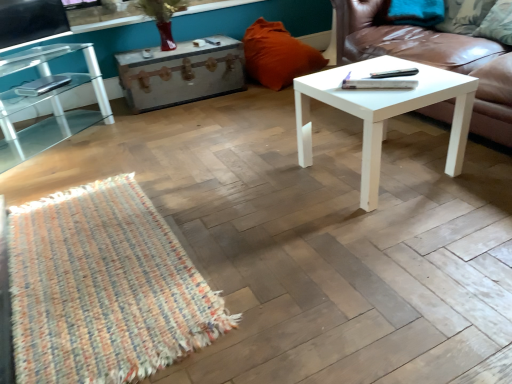
Question: Could you tell me if white leather couch at right is turned towards rustic wood trunk at center?

Choices:
 (A) yes
 (B) no

Answer: (B)

Question: Considering the relative sizes of white leather couch at right and rustic wood trunk at center in the image provided, is white leather couch at right taller than rustic wood trunk at center?

Choices:
 (A) no
 (B) yes

Answer: (B)

Question: Does white leather couch at right have a greater width compared to rustic wood trunk at center?

Choices:
 (A) yes
 (B) no

Answer: (A)

Question: Can you confirm if white leather couch at right is positioned to the left of rustic wood trunk at center?

Choices:
 (A) no
 (B) yes

Answer: (A)

Question: Are white leather couch at right and rustic wood trunk at center beside each other?

Choices:
 (A) no
 (B) yes

Answer: (A)

Question: In the image, is white leather couch at right positioned in front of or behind orange fabric pillow at upper center, the first pillow when ordered from left to right?

Choices:
 (A) behind
 (B) front

Answer: (B)

Question: Looking at the image, does white leather couch at right seem bigger or smaller compared to orange fabric pillow at upper center, which appears as the 2th pillow when viewed from the front?

Choices:
 (A) small
 (B) big

Answer: (B)

Question: Is white leather couch at right to the left or to the right of orange fabric pillow at upper center, which ranks as the 2th pillow in right-to-left order, in the image?

Choices:
 (A) right
 (B) left

Answer: (A)

Question: Is white leather couch at right situated inside orange fabric pillow at upper center, the first pillow when ordered from left to right, or outside?

Choices:
 (A) outside
 (B) inside

Answer: (A)

Question: Looking at their shapes, would you say white matte coffee table at center is wider or thinner than green fabric pillow at upper right, acting as the first pillow starting from the front?

Choices:
 (A) wide
 (B) thin

Answer: (A)

Question: Does point (444, 87) appear closer or farther from the camera than point (504, 29)?

Choices:
 (A) closer
 (B) farther

Answer: (A)

Question: In terms of height, does white matte coffee table at center look taller or shorter compared to green fabric pillow at upper right, which appears as the 2th pillow when viewed from the left?

Choices:
 (A) short
 (B) tall

Answer: (B)

Question: In the image, is white matte coffee table at center positioned in front of or behind green fabric pillow at upper right, which appears as the 2th pillow when viewed from the left?

Choices:
 (A) front
 (B) behind

Answer: (A)

Question: Considering the positions of clear glass table at left and rustic wood trunk at center in the image, is clear glass table at left taller or shorter than rustic wood trunk at center?

Choices:
 (A) short
 (B) tall

Answer: (B)

Question: From a real-world perspective, is clear glass table at left positioned above or below rustic wood trunk at center?

Choices:
 (A) above
 (B) below

Answer: (A)